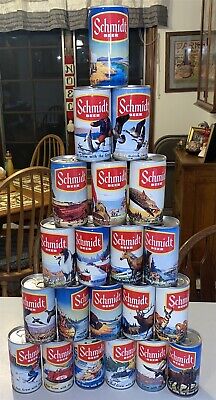
Where is `wooden tabletop`? The height and width of the screenshot is (400, 216). wooden tabletop is located at coordinates click(x=36, y=196).